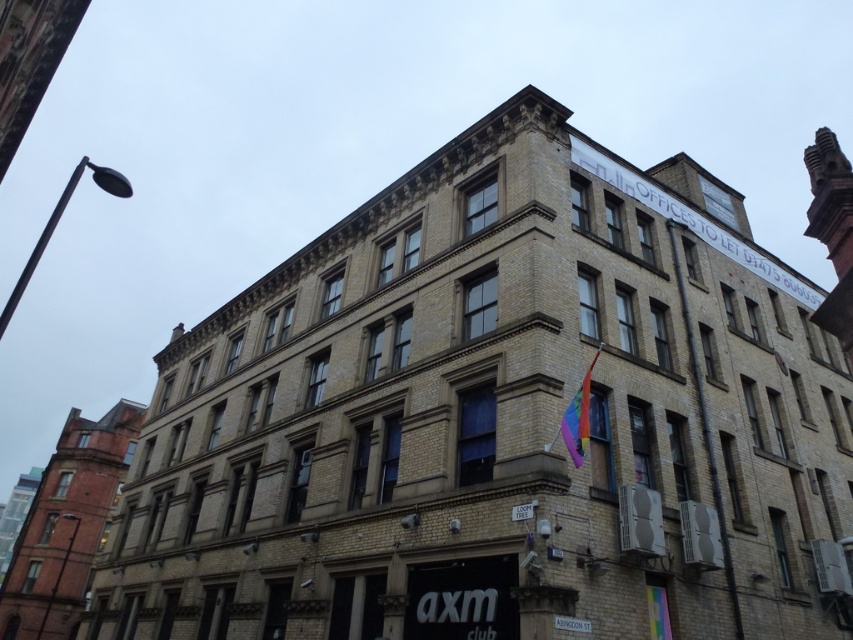
Between point (575, 420) and point (514, 518), which one is positioned behind?

The point (575, 420) is more distant.

Can you confirm if rainbow fabric flag at upper right is smaller than white plastic sign at lower center?

No, rainbow fabric flag at upper right is not smaller than white plastic sign at lower center.

Between point (564, 432) and point (532, 509), which one is positioned in front?

Point (532, 509) is in front.

Find the location of a particular element. rainbow fabric flag at upper right is located at coordinates (578, 417).